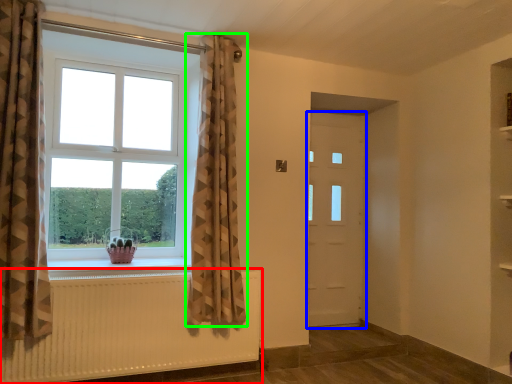
Question: Which is nearer to the radiator (highlighted by a red box)? door (highlighted by a blue box) or curtain (highlighted by a green box).

Choices:
 (A) door
 (B) curtain

Answer: (B)